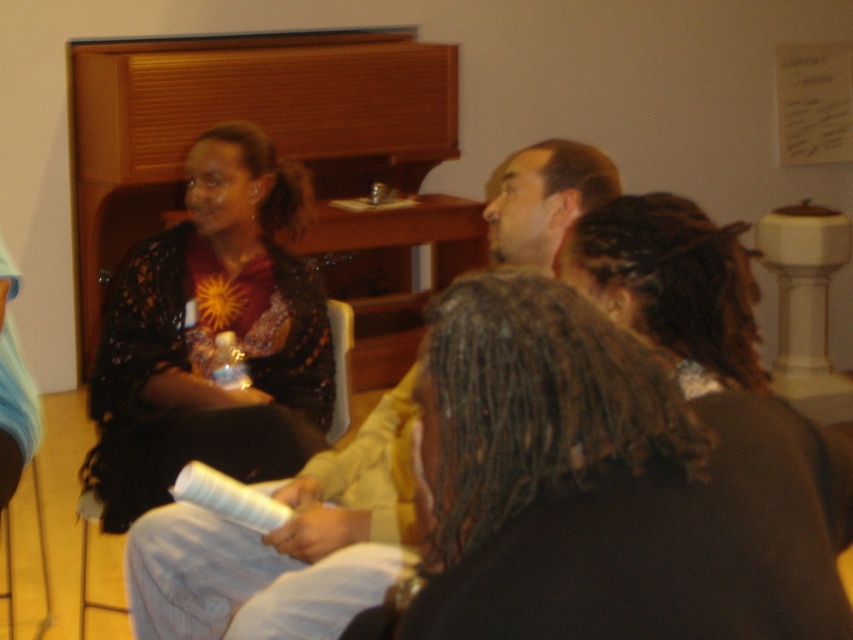
Question: Which of the following is the farthest from the observer?

Choices:
 (A) (447, 497)
 (B) (265, 182)
 (C) (572, 202)

Answer: (B)

Question: Does dark brown dreadlocks at center appear over matte black shirt at upper center?

Choices:
 (A) no
 (B) yes

Answer: (B)

Question: Which object appears farthest from the camera in this image?

Choices:
 (A) matte black shirt at upper center
 (B) matte black dress at left

Answer: (B)

Question: Among these objects, which one is nearest to the camera?

Choices:
 (A) matte black dress at left
 (B) matte black shirt at upper center

Answer: (B)

Question: Observing the image, what is the correct spatial positioning of matte black dress at left in reference to matte black shirt at upper center?

Choices:
 (A) right
 (B) left

Answer: (B)

Question: Does dark brown dreadlocks at center lie in front of matte black shirt at upper center?

Choices:
 (A) no
 (B) yes

Answer: (B)